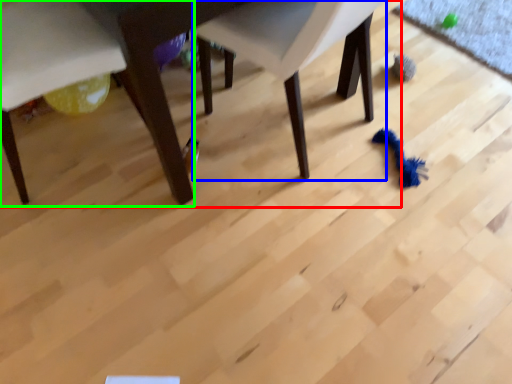
Question: Which object is the closest to the table (highlighted by a red box)? Choose among these: chair (highlighted by a blue box) or chair (highlighted by a green box).

Choices:
 (A) chair
 (B) chair

Answer: (B)